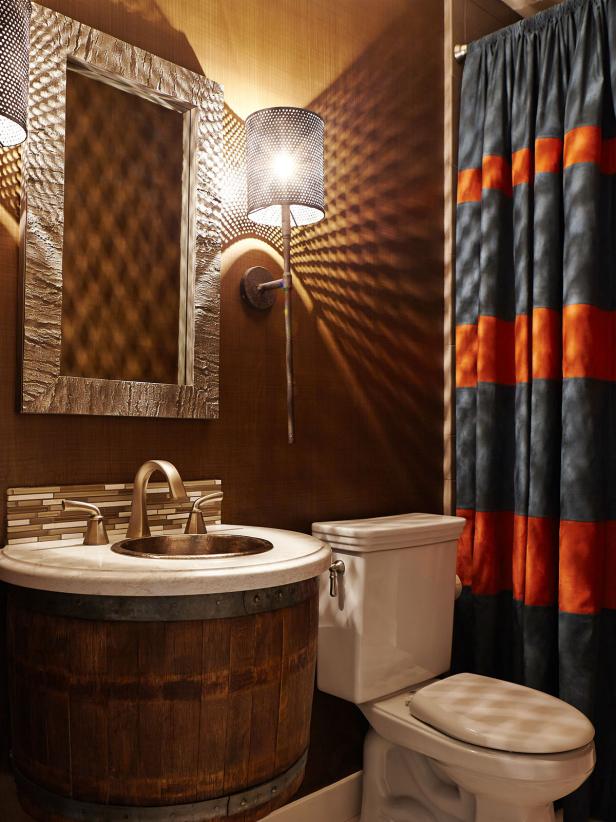
At what (x,y) coordinates should I click in order to perform the action: click on barrel shaped sink. Please return your answer as a coordinate pair (x, y). The width and height of the screenshot is (616, 822). Looking at the image, I should click on (207, 679).